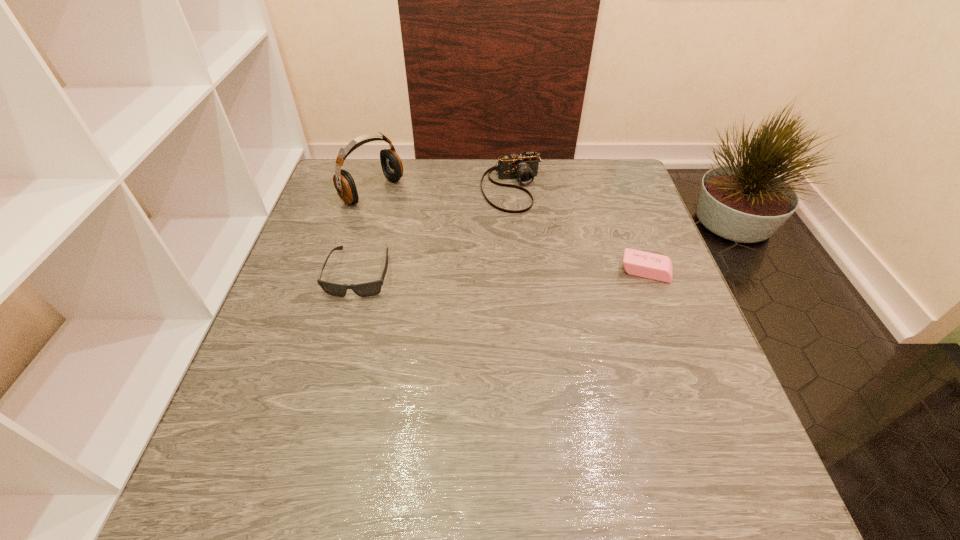
Locate an element on the screen. vacant space on the desktop that is between the sunglasses and the eraser and is positioned on the ear cups of the tallest object is located at coordinates (497, 272).

The image size is (960, 540). Find the location of `free space on the desktop that is between the sunglasses and the eraser and is positioned on the front-facing side of the camera`. free space on the desktop that is between the sunglasses and the eraser and is positioned on the front-facing side of the camera is located at coordinates (544, 272).